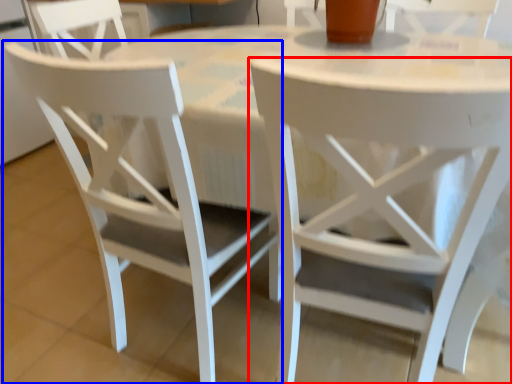
Question: Which point is further to the camera, chair (highlighted by a red box) or chair (highlighted by a blue box)?

Choices:
 (A) chair
 (B) chair

Answer: (B)